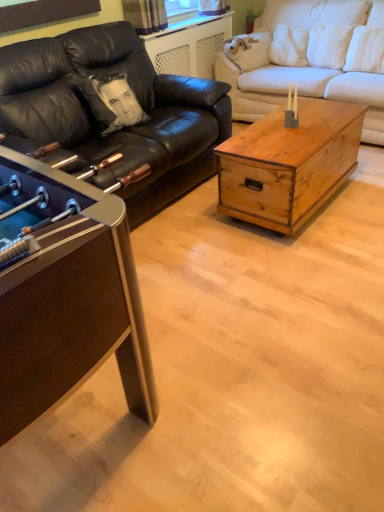
You are a GUI agent. You are given a task and a screenshot of the screen. Output one action in this format:
    pyautogui.click(x=<x>, y=<y>)
    Task: Click on the blank space situated above rustic wood trunk at center, positioned as the second coffee table in left-to-right order (from a real-world perspective)
    The width and height of the screenshot is (384, 512).
    Given the screenshot: What is the action you would take?
    pyautogui.click(x=288, y=134)